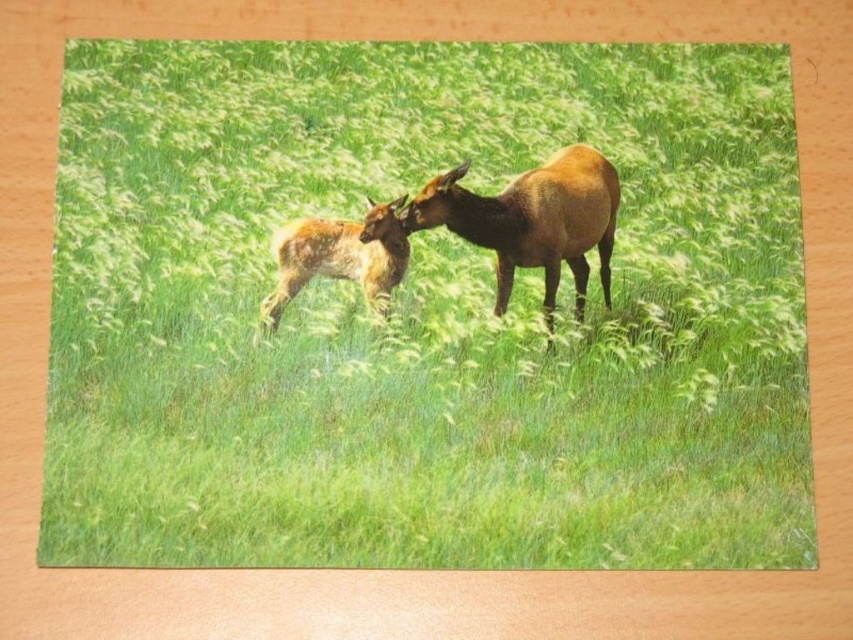
Image resolution: width=853 pixels, height=640 pixels. Find the location of `brown glossy deer at center`. brown glossy deer at center is located at coordinates (532, 220).

Between brown glossy deer at center and spotted fur deer at center, which one is positioned higher?

Positioned higher is brown glossy deer at center.

The height and width of the screenshot is (640, 853). What do you see at coordinates (532, 220) in the screenshot? I see `brown glossy deer at center` at bounding box center [532, 220].

This screenshot has height=640, width=853. Find the location of `brown glossy deer at center`. brown glossy deer at center is located at coordinates (532, 220).